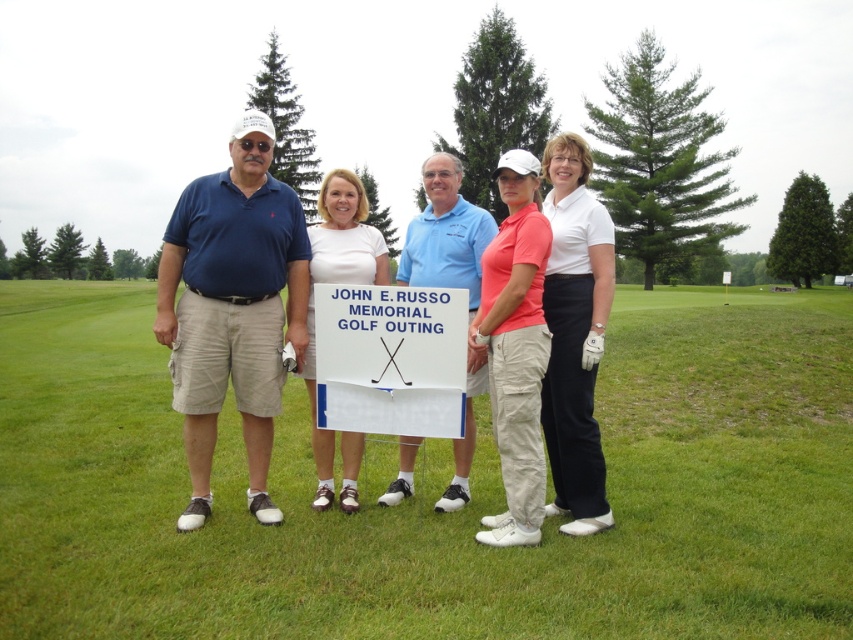
Is green grass at center bigger than white matte signboard at center?

Yes.

Which of these two, green grass at center or white matte signboard at center, stands shorter?

Standing shorter between the two is green grass at center.

Find the location of a particular element. This screenshot has width=853, height=640. green grass at center is located at coordinates (434, 490).

Locate an element on the screen. green grass at center is located at coordinates (434, 490).

Who is taller, white matte golf glove at center or white matte signboard at center?

white matte signboard at center is taller.

Which is behind, point (560, 417) or point (360, 266)?

Positioned behind is point (360, 266).

Who is more distant from viewer, (563, 433) or (343, 252)?

Point (343, 252)

At what (x,y) coordinates should I click in order to perform the action: click on white matte golf glove at center. Please return your answer as a coordinate pair (x, y). The width and height of the screenshot is (853, 640). Looking at the image, I should click on (575, 333).

Does green grass at center lie behind blue cotton polo shirt at center?

No, it is in front of blue cotton polo shirt at center.

Which is behind, point (486, 602) or point (410, 272)?

Point (410, 272)

Where is `green grass at center`? This screenshot has width=853, height=640. green grass at center is located at coordinates (434, 490).